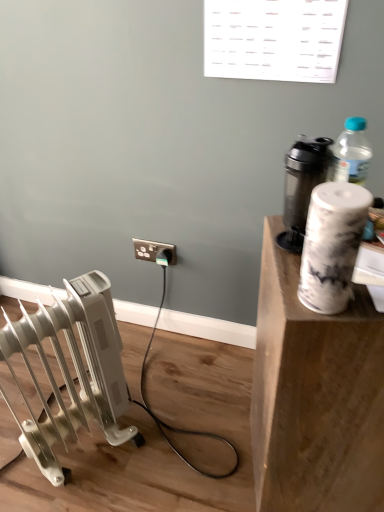
What is the approximate height of white marble cup at upper right?

The height of white marble cup at upper right is 74.72 centimeters.

You are a GUI agent. You are given a task and a screenshot of the screen. Output one action in this format:
    pyautogui.click(x=<x>, y=<y>)
    Task: Click on the white marble cup at upper right
    
    Given the screenshot: What is the action you would take?
    tap(315, 395)

What is the approximate width of white plastic radiator at lower left?

The width of white plastic radiator at lower left is 22.20 centimeters.

Measure the distance between point (169, 261) and camera.

Point (169, 261) is 4.59 feet away from camera.

What do you see at coordinates (154, 251) in the screenshot? This screenshot has height=512, width=384. I see `black plastic electric outlet at center` at bounding box center [154, 251].

Locate an element on the screen. white marble paper towel at upper right is located at coordinates (332, 245).

Identify the location of white marble cup at upper right. Image resolution: width=384 pixels, height=512 pixels. coord(315,395).

From the image's perspective, is metallic gray shaker at upper right on top of white plastic radiator at lower left?

Correct, metallic gray shaker at upper right appears higher than white plastic radiator at lower left in the image.

Is metallic gray shaker at upper right located outside white plastic radiator at lower left?

Yes, metallic gray shaker at upper right is located beyond the bounds of white plastic radiator at lower left.

How much distance is there between metallic gray shaker at upper right and white plastic radiator at lower left?

metallic gray shaker at upper right is 25.65 inches away from white plastic radiator at lower left.

Is metallic gray shaker at upper right to the left of white plastic radiator at lower left from the viewer's perspective?

No.

Is white plastic radiator at lower left located outside black plastic electric outlet at center?

Yes, white plastic radiator at lower left is located beyond the bounds of black plastic electric outlet at center.

Is black plastic electric outlet at center at the back of white plastic radiator at lower left?

No, black plastic electric outlet at center is not at the back of white plastic radiator at lower left.

Is the surface of white plastic radiator at lower left in direct contact with black plastic electric outlet at center?

No, white plastic radiator at lower left is not next to black plastic electric outlet at center.

Is white plastic radiator at lower left closer to camera compared to black plastic electric outlet at center?

That is True.

Considering the relative sizes of black plastic electric outlet at center and white plastic radiator at lower left in the image provided, is black plastic electric outlet at center bigger than white plastic radiator at lower left?

No, black plastic electric outlet at center is not bigger than white plastic radiator at lower left.

Is black plastic electric outlet at center inside the boundaries of white plastic radiator at lower left, or outside?

black plastic electric outlet at center is spatially situated outside white plastic radiator at lower left.

From the image's perspective, who appears lower, black plastic electric outlet at center or white plastic radiator at lower left?

white plastic radiator at lower left is shown below in the image.

From the image's perspective, which one is positioned lower, white marble paper towel at upper right or white marble cup at upper right?

white marble cup at upper right is shown below in the image.

Who is smaller, white marble paper towel at upper right or white marble cup at upper right?

Smaller between the two is white marble paper towel at upper right.

Is white marble paper towel at upper right facing towards white marble cup at upper right?

No, white marble paper towel at upper right is not aimed at white marble cup at upper right.

From a real-world perspective, between white marble paper towel at upper right and white marble cup at upper right, who is vertically higher?

In real-world perspective, white marble paper towel at upper right is above.

Is white plastic radiator at lower left touching white marble cup at upper right?

No, white plastic radiator at lower left is not in contact with white marble cup at upper right.

The width and height of the screenshot is (384, 512). Identify the location of radiator below the white marble cup at upper right (from a real-world perspective). (68, 369).

Considering the relative sizes of white plastic radiator at lower left and white marble cup at upper right in the image provided, is white plastic radiator at lower left wider than white marble cup at upper right?

No.

Is white plastic radiator at lower left positioned beyond the bounds of white marble cup at upper right?

Absolutely, white plastic radiator at lower left is external to white marble cup at upper right.

Considering the points (94, 340) and (310, 224), which point is in front, point (94, 340) or point (310, 224)?

Point (310, 224)

Does white plastic radiator at lower left have a larger size compared to white marble paper towel at upper right?

Yes.

Is white plastic radiator at lower left facing towards white marble paper towel at upper right?

No, white plastic radiator at lower left is not aimed at white marble paper towel at upper right.

Is white plastic radiator at lower left at the right side of white marble paper towel at upper right?

No.

Is metallic gray shaker at upper right turned away from black plastic electric outlet at center?

That's not correct — metallic gray shaker at upper right is not looking away from black plastic electric outlet at center.

Which object is further away from the camera, metallic gray shaker at upper right or black plastic electric outlet at center?

black plastic electric outlet at center is further away from the camera.

Considering the relative positions of metallic gray shaker at upper right and black plastic electric outlet at center in the image provided, is metallic gray shaker at upper right to the left or to the right of black plastic electric outlet at center?

metallic gray shaker at upper right is positioned on black plastic electric outlet at center's right side.

From a real-world perspective, which object rests below the other?

From a 3D spatial view, black plastic electric outlet at center is below.

I want to click on appliance located above the white plastic radiator at lower left (from a real-world perspective), so click(x=302, y=186).

Identify the location of electric outlet on the right side of white plastic radiator at lower left. The width and height of the screenshot is (384, 512). (x=154, y=251).

Looking at the image, which one is located closer to metallic gray shaker at upper right, white plastic radiator at lower left or white marble paper towel at upper right?

white marble paper towel at upper right.

Looking at the image, which one is located further to white marble cup at upper right, black plastic electric outlet at center or metallic gray shaker at upper right?

Among the two, black plastic electric outlet at center is located further to white marble cup at upper right.

Considering their positions, is white marble paper towel at upper right positioned closer to metallic gray shaker at upper right than white plastic radiator at lower left?

white marble paper towel at upper right is positioned closer to the anchor metallic gray shaker at upper right.

Estimate the real-world distances between objects in this image. Which object is closer to white marble paper towel at upper right, white plastic radiator at lower left or metallic gray shaker at upper right?

metallic gray shaker at upper right is positioned closer to the anchor white marble paper towel at upper right.

In the scene shown: Estimate the real-world distances between objects in this image. Which object is closer to white plastic radiator at lower left, white marble paper towel at upper right or metallic gray shaker at upper right?

metallic gray shaker at upper right lies closer to white plastic radiator at lower left than the other object.

Based on their spatial positions, is black plastic electric outlet at center or white plastic radiator at lower left further from white marble paper towel at upper right?

Among the two, black plastic electric outlet at center is located further to white marble paper towel at upper right.

Estimate the real-world distances between objects in this image. Which object is further from white marble paper towel at upper right, white plastic radiator at lower left or white marble cup at upper right?

Based on the image, white plastic radiator at lower left appears to be further to white marble paper towel at upper right.

Based on their spatial positions, is black plastic electric outlet at center or white marble cup at upper right further from white marble paper towel at upper right?

Based on the image, black plastic electric outlet at center appears to be further to white marble paper towel at upper right.

The width and height of the screenshot is (384, 512). Find the location of `paper towel that lies between metallic gray shaker at upper right and white marble cup at upper right from top to bottom`. paper towel that lies between metallic gray shaker at upper right and white marble cup at upper right from top to bottom is located at coordinates (332, 245).

This screenshot has width=384, height=512. Identify the location of appliance between white marble cup at upper right and black plastic electric outlet at center along the z-axis. (302, 186).

Locate an element on the screen. Image resolution: width=384 pixels, height=512 pixels. radiator located between metallic gray shaker at upper right and black plastic electric outlet at center in the depth direction is located at coordinates (68, 369).

Find the location of a particular element. The height and width of the screenshot is (512, 384). paper towel between white plastic radiator at lower left and white marble cup at upper right from left to right is located at coordinates (332, 245).